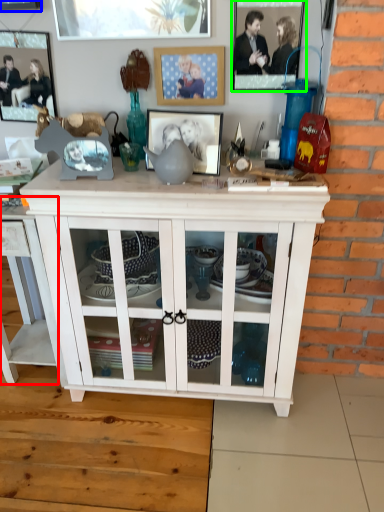
Question: Considering the real-world distances, which object is farthest from table (highlighted by a red box)? picture frame (highlighted by a blue box) or picture frame (highlighted by a green box)?

Choices:
 (A) picture frame
 (B) picture frame

Answer: (B)